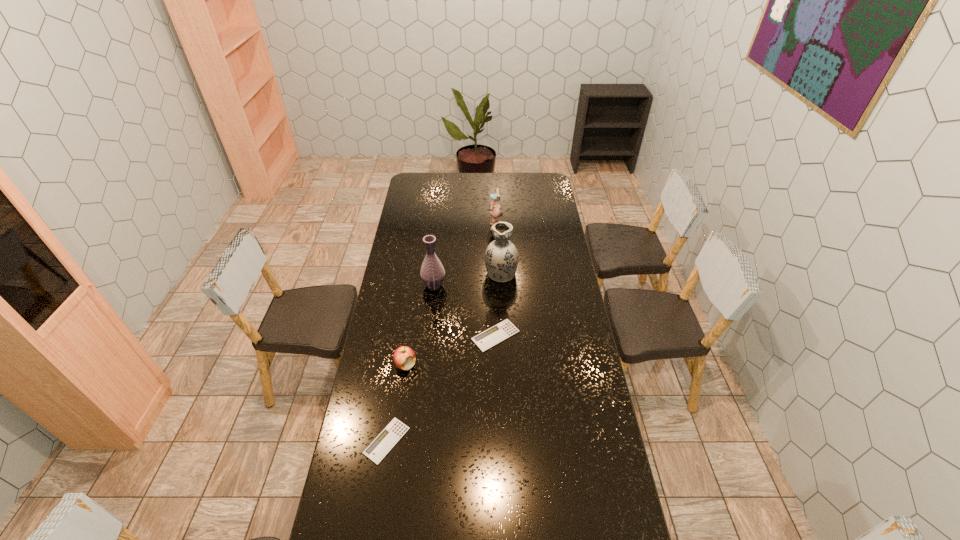
I want to click on free space located 0.230m on the back of the nearest object, so click(399, 365).

Identify the location of free spot located 0.380m on the front of the farther calculator. (499, 442).

Where is `free space located 0.400m on the front of the left vase`? free space located 0.400m on the front of the left vase is located at coordinates (425, 366).

Identify the location of blank space located 0.340m on the front-facing side of the figurine. This screenshot has height=540, width=960. (427, 227).

Find the location of a particular element. The image size is (960, 540). blank area located on the front-facing side of the figurine is located at coordinates (421, 227).

Locate an element on the screen. free space located on the front-facing side of the figurine is located at coordinates (450, 227).

Identify the location of vacant space located 0.400m with the handle on the side of the right vase. Image resolution: width=960 pixels, height=540 pixels. (498, 214).

This screenshot has width=960, height=540. In order to click on vacant space located 0.090m with the handle on the side of the right vase in this screenshot , I will do `click(500, 249)`.

Image resolution: width=960 pixels, height=540 pixels. What are the coordinates of `free region located with the handle on the side of the right vase` in the screenshot? It's located at (498, 230).

The image size is (960, 540). I want to click on vacant space positioned on the right of the fourth tallest object, so click(494, 364).